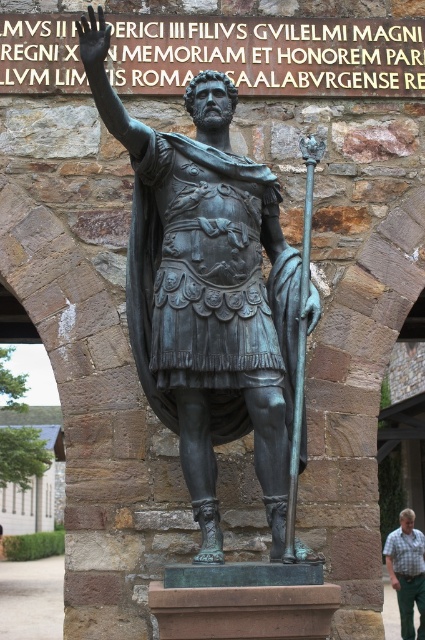
You are an artist planning to sketch the bronze statue and its surroundings. You notice the bronze spear at center and the green plaid shirt at lower right. Which object has a smaller width when viewed from your perspective?

The bronze spear at center has a smaller width than the green plaid shirt at lower right according to the description.

You are a tourist visiting a historical site and notice the bronze statue at center and the green plaid shirt at lower right in the image. From your perspective, which object is positioned more to the right?

The green plaid shirt at lower right is positioned more to the right than the bronze statue at center.